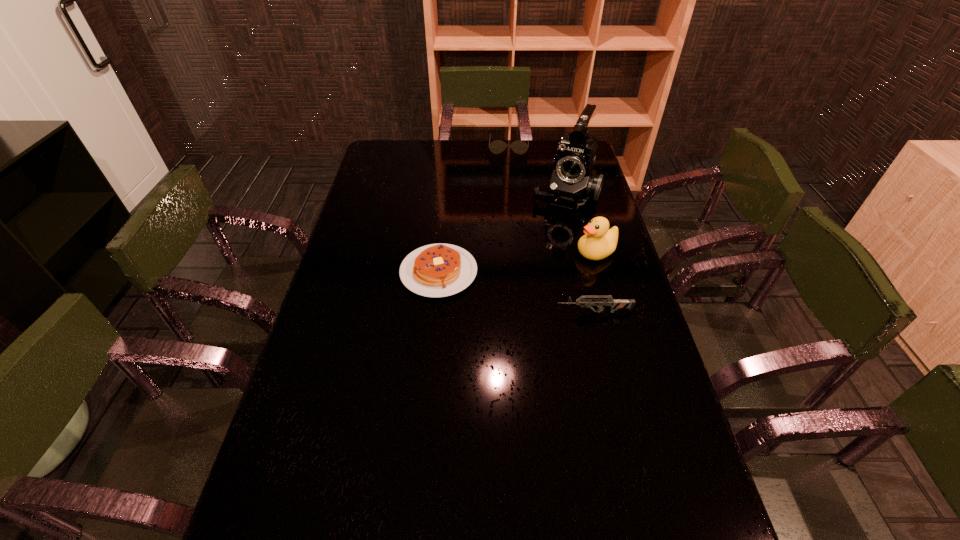
Find the location of a particular element. vacant area in the image that satisfies the following two spatial constraints: 1. on the front side of the tallest object; 2. on the right side of the duck is located at coordinates (580, 253).

At what (x,y) coordinates should I click in order to perform the action: click on vacant area that satisfies the following two spatial constraints: 1. on the front side of the fourth shortest object; 2. on the left side of the tallest object. Please return your answer as a coordinate pair (x, y). Image resolution: width=960 pixels, height=540 pixels. Looking at the image, I should click on (580, 253).